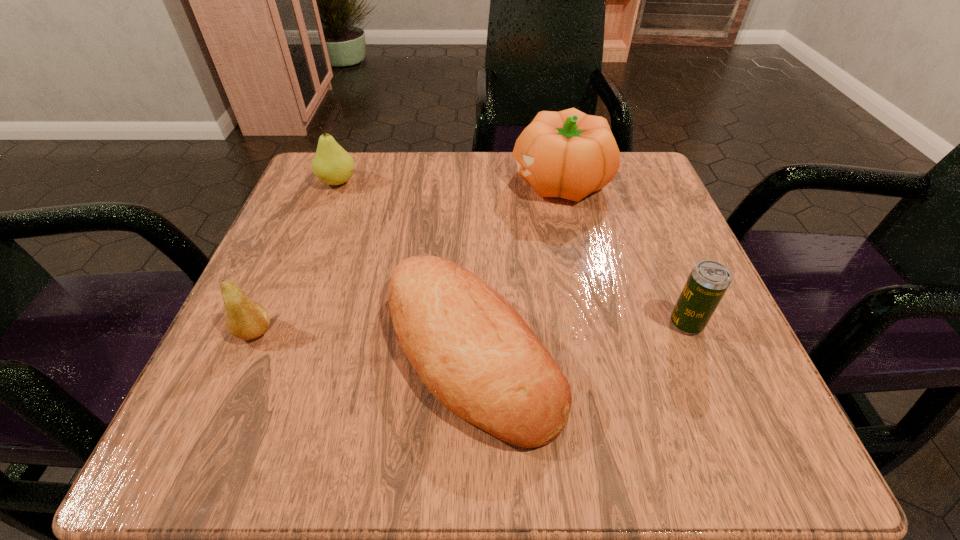
Where is `vacant region that satisfies the following two spatial constraints: 1. on the carved face of the pumpkin; 2. on the front side of the shorter pear`? The image size is (960, 540). vacant region that satisfies the following two spatial constraints: 1. on the carved face of the pumpkin; 2. on the front side of the shorter pear is located at coordinates (593, 332).

Where is `blank area in the image that satisfies the following two spatial constraints: 1. on the back side of the shorter pear; 2. on the right side of the beer can`? This screenshot has width=960, height=540. blank area in the image that satisfies the following two spatial constraints: 1. on the back side of the shorter pear; 2. on the right side of the beer can is located at coordinates (258, 323).